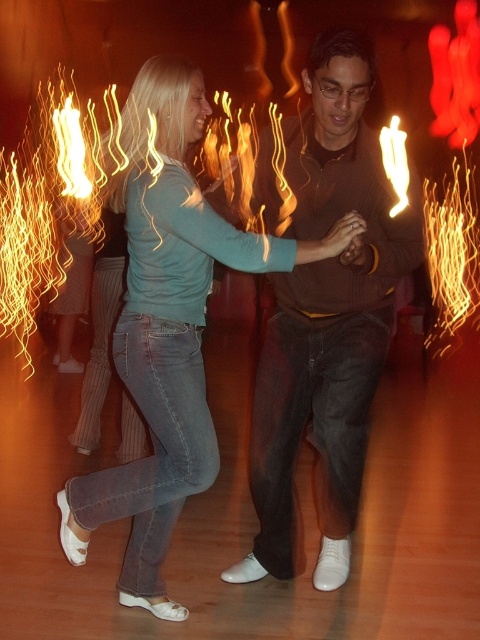
Question: Does dark brown sweater at center come in front of matte teal shirt at center?

Choices:
 (A) yes
 (B) no

Answer: (A)

Question: Which point is closer to the camera taking this photo?

Choices:
 (A) (256, 477)
 (B) (180, 234)

Answer: (B)

Question: Is dark brown sweater at center bigger than matte teal shirt at center?

Choices:
 (A) no
 (B) yes

Answer: (B)

Question: Among these points, which one is nearest to the camera?

Choices:
 (A) (327, 275)
 (B) (132, 285)

Answer: (B)

Question: Does dark brown sweater at center appear on the right side of matte teal shirt at center?

Choices:
 (A) no
 (B) yes

Answer: (B)

Question: Among these points, which one is nearest to the camera?

Choices:
 (A) (263, 164)
 (B) (133, 116)

Answer: (B)